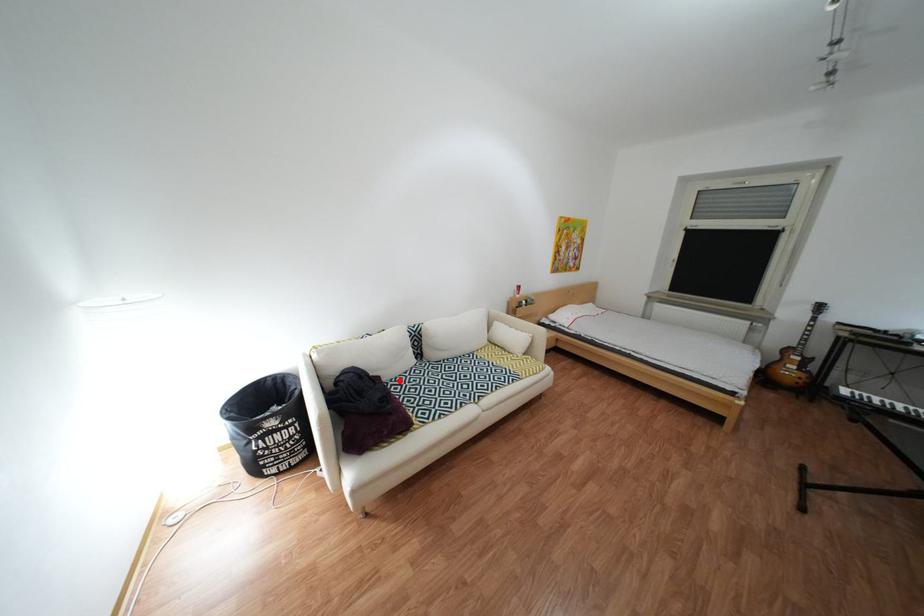
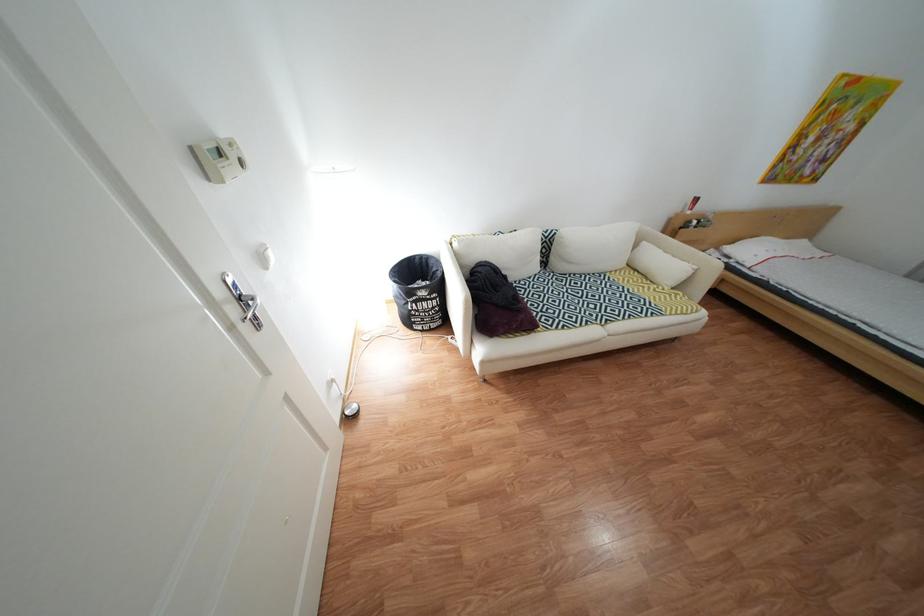
In the second image, find the point that corresponds to the highlighted location in the first image.

(525, 281)